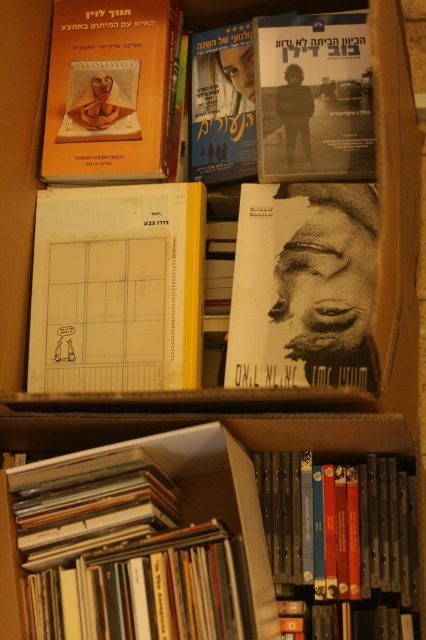
Between black matte book at upper center and matte paper movie poster at upper center, which one is positioned higher?

Positioned higher is matte paper movie poster at upper center.

Who is more forward, (264,179) or (229,86)?

Point (264,179) is in front.

Who is more distant from viewer, (267, 20) or (221, 147)?

Point (221, 147)

I want to click on black matte book at upper center, so click(313, 97).

Can you confirm if black cardboard box at lower center is positioned above black matte book at upper center?

No.

Who is more forward, (157,570) or (314,154)?

Point (157,570) is more forward.

The height and width of the screenshot is (640, 426). Identify the location of black cardboard box at lower center. (141, 541).

Based on the photo, is black cardboard box at lower center to the left of matte paper book at upper left from the viewer's perspective?

Incorrect, black cardboard box at lower center is not on the left side of matte paper book at upper left.

Image resolution: width=426 pixels, height=640 pixels. What are the coordinates of `black cardboard box at lower center` in the screenshot? It's located at (141, 541).